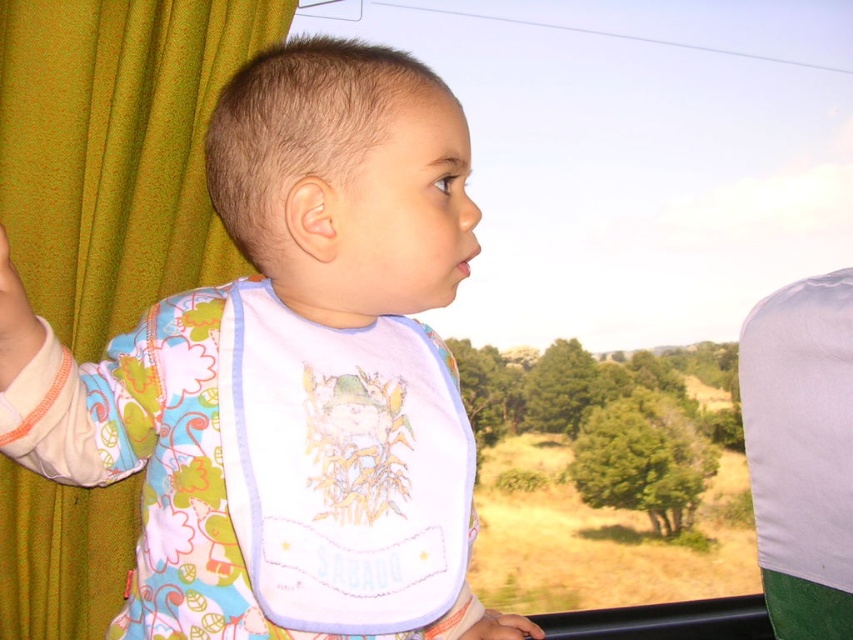
You are a parent trying to ensure your child stays within a safe distance while on a bus. The child is standing near the window, and you notice a point marked at coordinates point (78, 616). If the recommended safe distance is 36 inches, is the child currently within the safe zone?

The point (78, 616) and the viewer are 37.15 inches apart, which exceeds the recommended safe distance of 36 inches. Therefore, the child is slightly outside the safe zone and needs to move closer.

Looking at this image, you are on a bus and see two points marked on the window. The first point is at coordinates point (111, 26) and the second is at point (535, 632). From your perspective inside the bus, which point is closer to you?

Point (535, 632) is closer to you because point (111, 26) is behind it according to their spatial arrangement.

You are a passenger on a bus and want to see the view outside better. You notice the green fabric curtain at left and the white fabric bib at center. Which object is taller and might block your view more if it is in front of the window?

The green fabric curtain at left is taller than the white fabric bib at center, so it might block your view more if it is in front of the window.